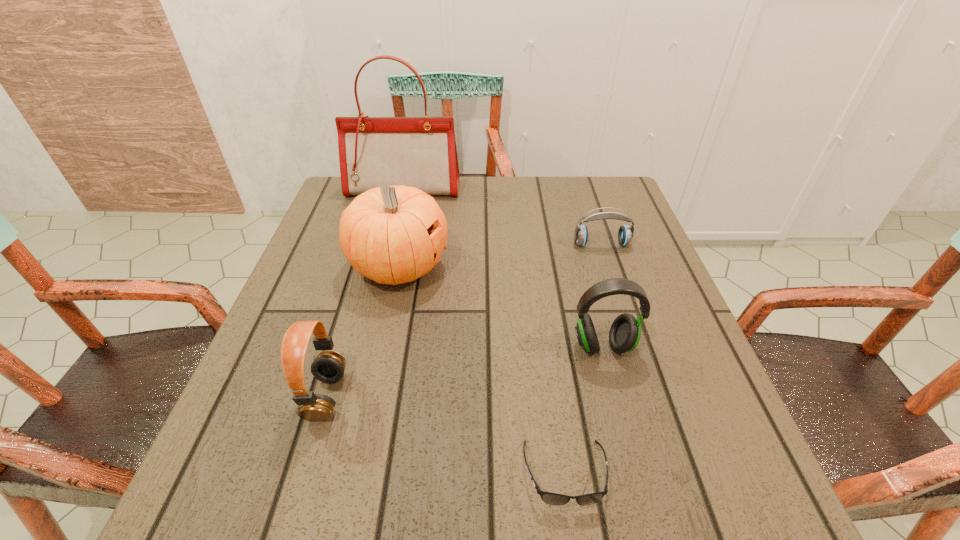
This screenshot has width=960, height=540. I want to click on vacant area situated on the right of the tallest object, so 508,189.

This screenshot has width=960, height=540. Identify the location of blank area located 0.090m on the front-facing side of the second tallest object. [488, 266].

Find the location of a particular element. The height and width of the screenshot is (540, 960). vacant space situated 0.220m on the ear cups of the leftmost headset is located at coordinates (471, 396).

Locate an element on the screen. vacant space situated on the ear cups of the fourth farthest object is located at coordinates (651, 526).

In order to click on blank space located 0.140m on the ear cups of the fifth tallest object in this screenshot , I will do `click(616, 291)`.

Where is `object that is at the far edge`? object that is at the far edge is located at coordinates (420, 152).

The height and width of the screenshot is (540, 960). Identify the location of object situated at the near edge. (550, 498).

Image resolution: width=960 pixels, height=540 pixels. What are the coordinates of `handbag located in the left edge section of the desktop` in the screenshot? It's located at (420, 152).

The height and width of the screenshot is (540, 960). In order to click on pumpkin located in the left edge section of the desktop in this screenshot , I will do [x=392, y=235].

You are a GUI agent. You are given a task and a screenshot of the screen. Output one action in this format:
    pyautogui.click(x=<x>, y=<y>)
    Task: Click on the headset that is positioned at the left edge
    The height and width of the screenshot is (540, 960).
    Given the screenshot: What is the action you would take?
    pyautogui.click(x=329, y=366)